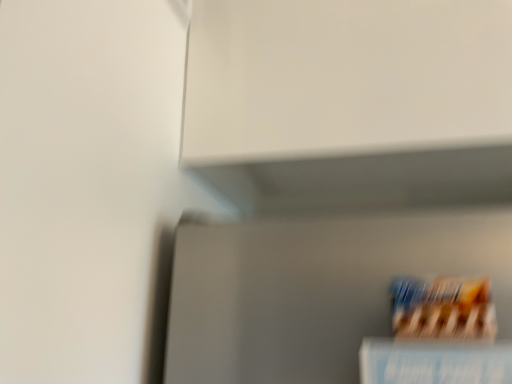
Question: From their relative heights in the image, would you say blue paper book at lower right is taller or shorter than blue cardboard cereal at lower right?

Choices:
 (A) short
 (B) tall

Answer: (B)

Question: Looking at their shapes, would you say blue paper book at lower right is wider or thinner than blue cardboard cereal at lower right?

Choices:
 (A) wide
 (B) thin

Answer: (A)

Question: Considering the positions of point (501, 375) and point (399, 294), is point (501, 375) closer or farther from the camera than point (399, 294)?

Choices:
 (A) closer
 (B) farther

Answer: (A)

Question: Considering their positions, is blue cardboard cereal at lower right located in front of or behind blue paper book at lower right?

Choices:
 (A) behind
 (B) front

Answer: (A)

Question: Do you think blue cardboard cereal at lower right is within blue paper book at lower right, or outside of it?

Choices:
 (A) outside
 (B) inside

Answer: (A)

Question: Is point (429, 306) positioned closer to the camera than point (422, 365)?

Choices:
 (A) farther
 (B) closer

Answer: (A)

Question: In terms of size, does blue cardboard cereal at lower right appear bigger or smaller than blue paper book at lower right?

Choices:
 (A) small
 (B) big

Answer: (A)